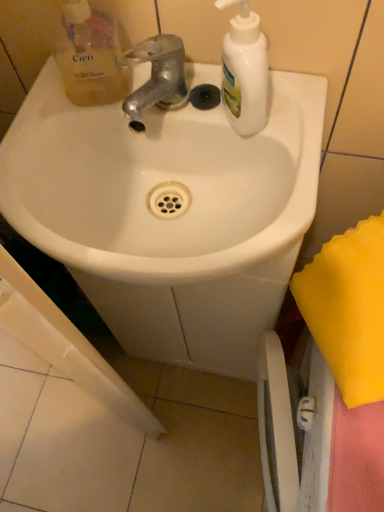
Question: Considering the positions of point (6, 146) and point (240, 92), is point (6, 146) closer or farther from the camera than point (240, 92)?

Choices:
 (A) farther
 (B) closer

Answer: (A)

Question: Is white glossy sink at center inside the boundaries of white matte bottle at upper right, or outside?

Choices:
 (A) outside
 (B) inside

Answer: (A)

Question: Based on their relative distances, which object is nearer to the shiny metallic faucet at center?

Choices:
 (A) translucent yellow liquid soap at upper left
 (B) white matte bottle at upper right
 (C) white glossy sink at center

Answer: (A)

Question: Estimate the real-world distances between objects in this image. Which object is farther from the translucent yellow liquid soap at upper left?

Choices:
 (A) white matte bottle at upper right
 (B) white glossy sink at center
 (C) shiny metallic faucet at center

Answer: (A)